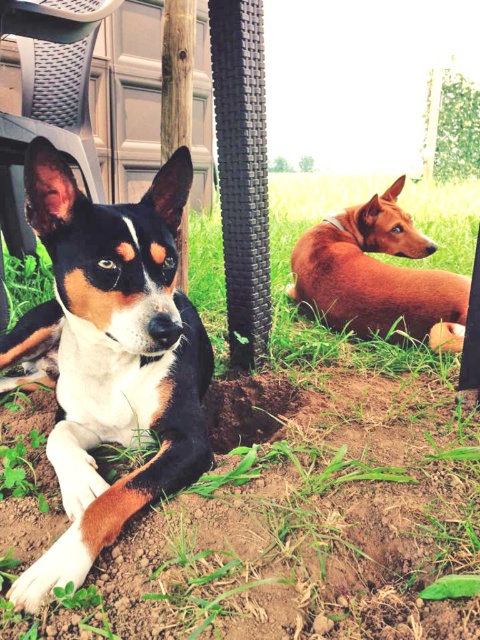
You are standing in the middle of the scene and want to step onto the green grass at center. Based on its position, which direction should you move to reach it?

The green grass at center is located at point coordinates indicating it is to the right and slightly forward from your current position in the middle. Move towards the right and forward to reach it.

You are a photographer setting up a tripod in the middle of the scene. You need to place it on the green grass at center without blocking the view of the white fur dog at center. Given their height relationship, is this possible?

The green grass at center has a lesser height compared to white fur dog at center, so placing the tripod on the green grass at center should not block the view of the white fur dog at center since the dog is taller.